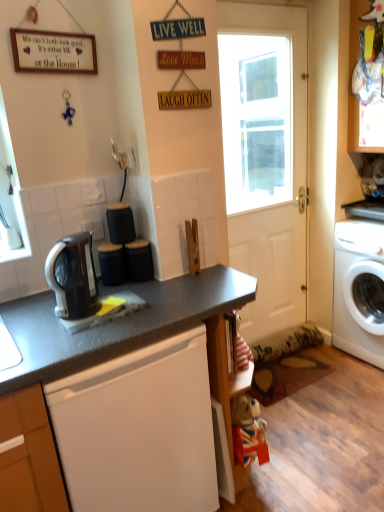
Locate an element on the screen. The height and width of the screenshot is (512, 384). free space to the left of black glossy coffee maker at left is located at coordinates (39, 313).